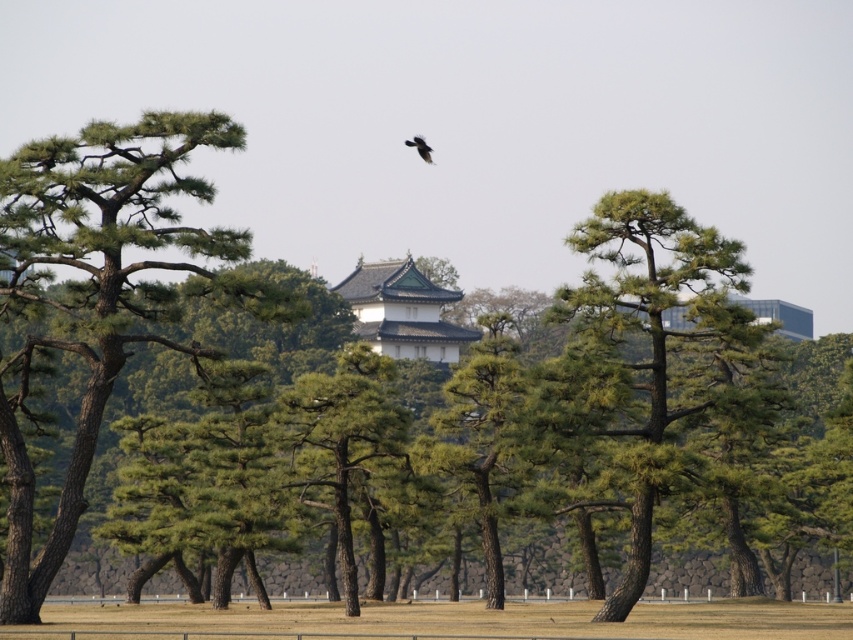
You are an architect designing a new garden path that must pass between the green matte tree at center and the black matte bird at upper center. The path must be wide enough to accommodate two people walking side by side. Given that the average width required for two people is 1.2 meters, can the space between these two objects accommodate this requirement?

The green matte tree at center is wider than the black matte bird at upper center, but the exact width of the space between them isn

You are a landscape architect planning to add a new pathway between the green matte tree at left and the green matte tree at center. Considering their sizes, which tree will require more space to accommodate its canopy?

The green matte tree at left is larger in size than the green matte tree at center, so it will require more space to accommodate its canopy.

You are standing at the point marked as point (648, 362) in the image. Looking around, you see a green matte tree at center and other objects in the scene. Which object is directly beneath your feet?

The point (648, 362) is on the green matte tree at center, so the object directly beneath your feet is the green matte tree at center.